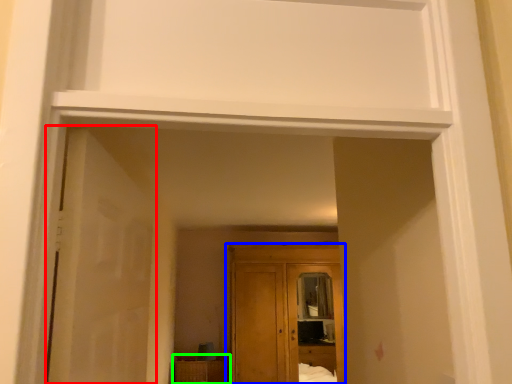
Question: Which object is positioned farthest from door (highlighted by a red box)? Select from cupboard (highlighted by a blue box) and cabinetry (highlighted by a green box).

Choices:
 (A) cupboard
 (B) cabinetry

Answer: (B)